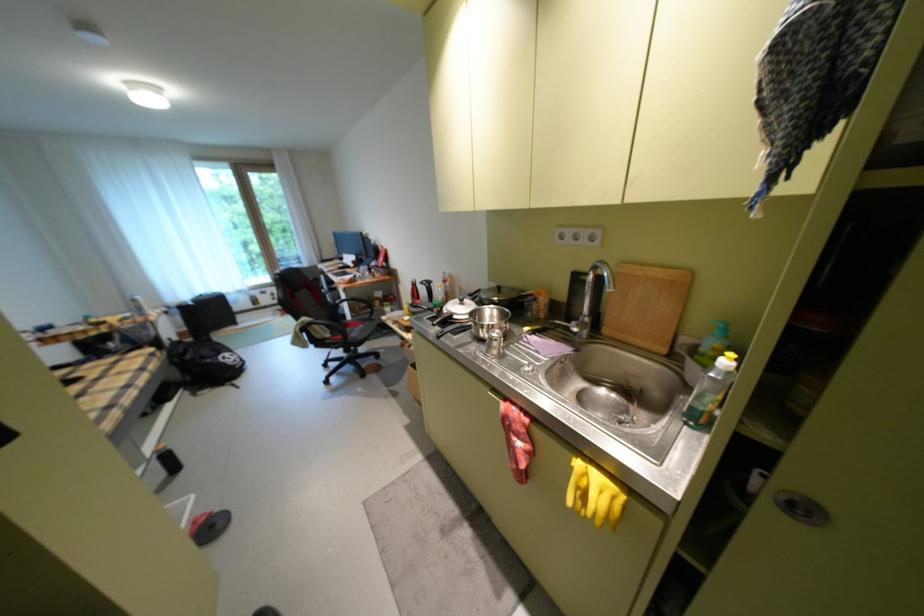
Describe the element at coordinates (354, 312) in the screenshot. I see `the chair armrest` at that location.